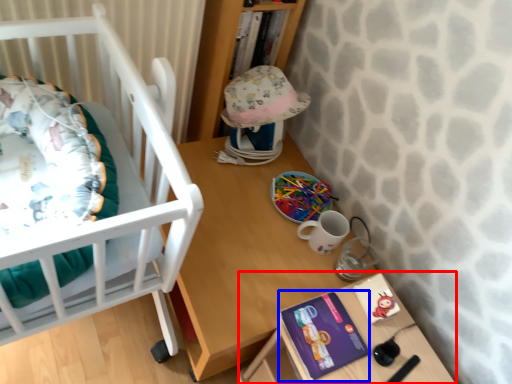
Question: Which of the following is the farthest to the observer, changing table (highlighted by a red box) or paperback book (highlighted by a blue box)?

Choices:
 (A) changing table
 (B) paperback book

Answer: (B)